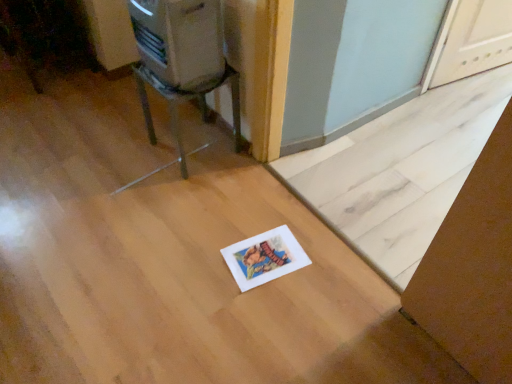
Identify the location of empty space that is ontop of white paper at lower center (from a real-world perspective). (395, 160).